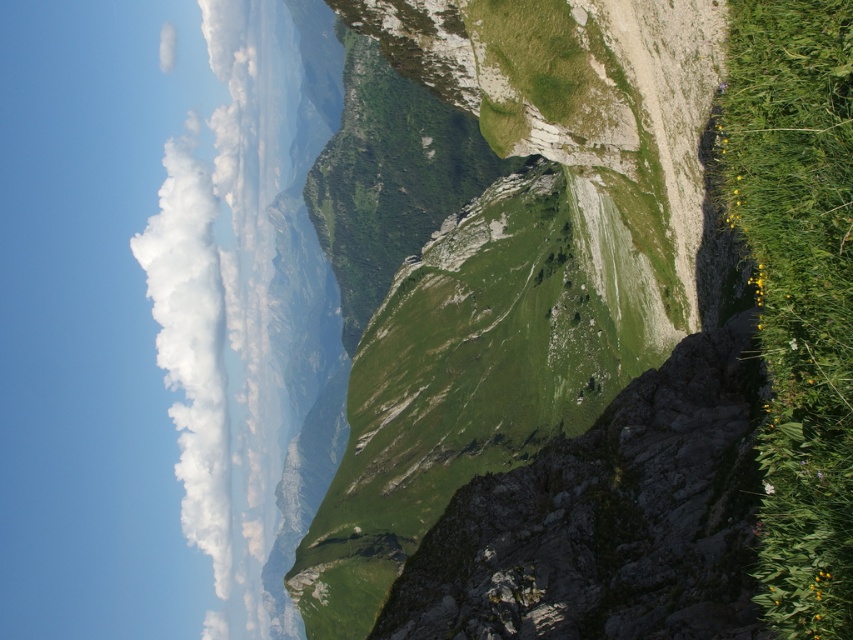
Can you confirm if green grassy hillside at center is smaller than white fluffy cloud at upper left?

Actually, green grassy hillside at center might be larger than white fluffy cloud at upper left.

Is green grassy hillside at center wider than white fluffy cloud at upper left?

No, green grassy hillside at center is not wider than white fluffy cloud at upper left.

Who is more distant from viewer, (322, 522) or (268, 289)?

The point (268, 289) is behind.

Find the location of a particular element. The height and width of the screenshot is (640, 853). green grassy hillside at center is located at coordinates point(503,257).